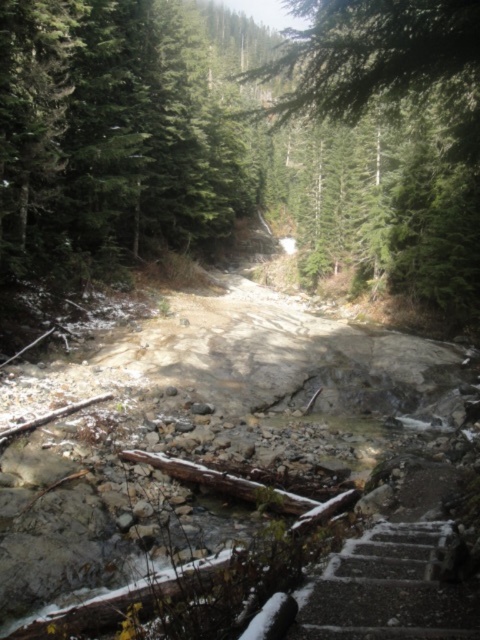
Question: Is the position of green matte tree at center less distant than that of dark gray concrete stairs at lower right?

Choices:
 (A) no
 (B) yes

Answer: (A)

Question: Which point is closer to the camera?

Choices:
 (A) brown rocky dirt track at center
 (B) green matte tree at center
 (C) dark gray concrete stairs at lower right

Answer: (C)

Question: Estimate the real-world distances between objects in this image. Which object is farther from the dark gray concrete stairs at lower right?

Choices:
 (A) green matte tree at center
 (B) brown rocky dirt track at center

Answer: (A)

Question: Is green matte tree at center smaller than dark gray concrete stairs at lower right?

Choices:
 (A) no
 (B) yes

Answer: (A)

Question: Which object appears closest to the camera in this image?

Choices:
 (A) brown rocky dirt track at center
 (B) green matte tree at center
 (C) dark gray concrete stairs at lower right

Answer: (C)

Question: Is brown rocky dirt track at center further to camera compared to dark gray concrete stairs at lower right?

Choices:
 (A) no
 (B) yes

Answer: (B)